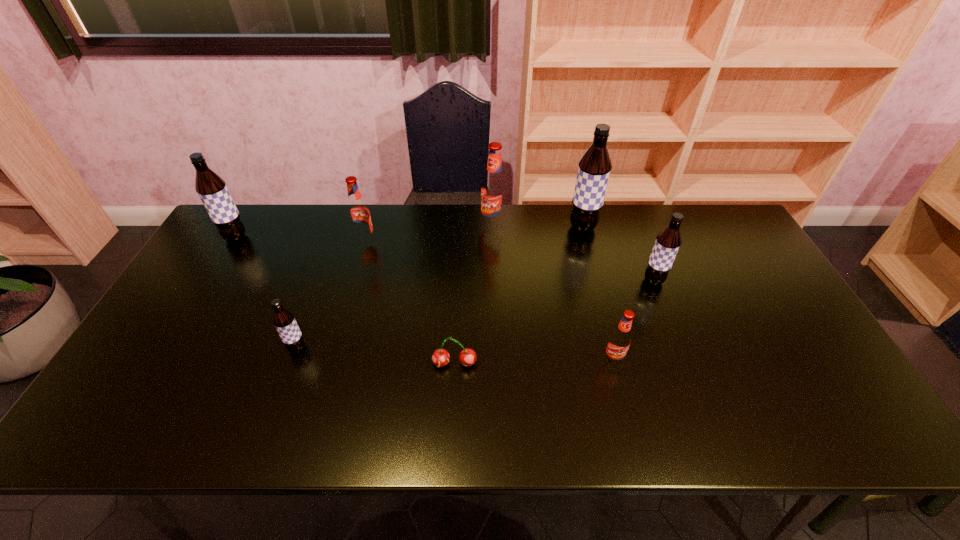
Where is `the rightmost red root beer`? The image size is (960, 540). the rightmost red root beer is located at coordinates (619, 341).

Image resolution: width=960 pixels, height=540 pixels. I want to click on the nearest red root beer, so click(x=619, y=341).

Find the location of a particular element. Image resolution: width=960 pixels, height=540 pixels. the nearest brown root beer is located at coordinates (284, 321).

The height and width of the screenshot is (540, 960). What are the coordinates of `the smallest brown root beer` in the screenshot? It's located at (284, 321).

Where is `the shortest object`? The width and height of the screenshot is (960, 540). the shortest object is located at coordinates (440, 357).

This screenshot has width=960, height=540. What are the coordinates of `the fifth object from right to left` in the screenshot? It's located at (440, 357).

You are a GUI agent. You are given a task and a screenshot of the screen. Output one action in this format:
    pyautogui.click(x=<x>, y=<y>)
    Task: Click on the free space located on the left of the biggest brown root beer
    
    Given the screenshot: What is the action you would take?
    pyautogui.click(x=503, y=227)

I want to click on vacant space situated 0.060m on the back of the third smallest brown root beer, so click(x=247, y=218).

Locate an element on the screen. free region located on the left of the second red root beer from right to left is located at coordinates (393, 225).

You are a GUI agent. You are given a task and a screenshot of the screen. Output one action in this format:
    pyautogui.click(x=<x>, y=<y>)
    Task: Click on the vacant space located on the right of the second farthest red root beer
    The height and width of the screenshot is (540, 960).
    Given the screenshot: What is the action you would take?
    pyautogui.click(x=458, y=242)